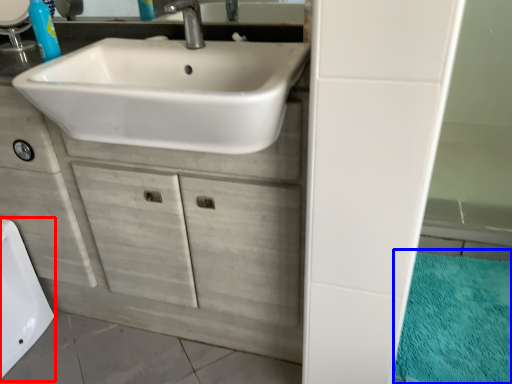
Question: Which of the following is the closest to the observer, bath (highlighted by a red box) or bath mat (highlighted by a blue box)?

Choices:
 (A) bath
 (B) bath mat

Answer: (B)